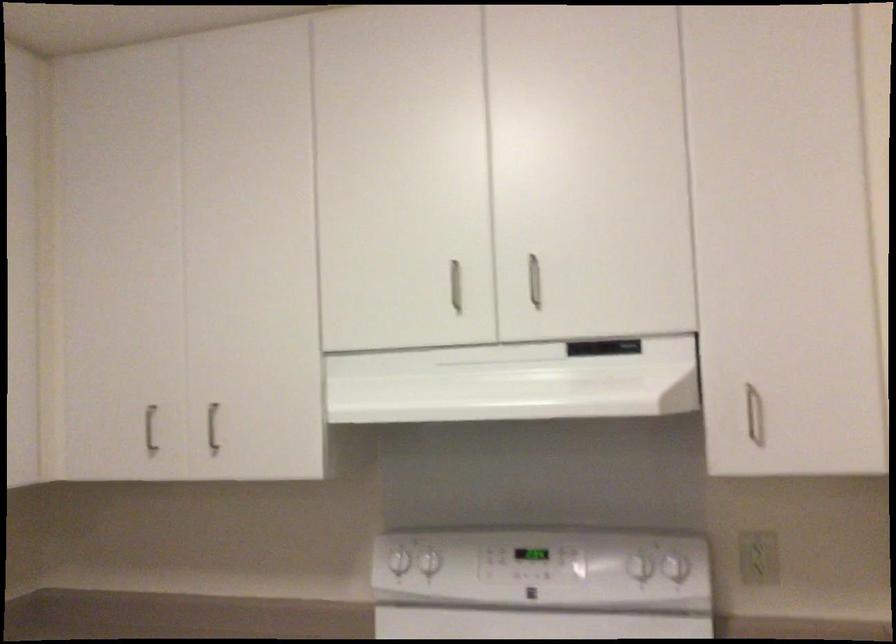
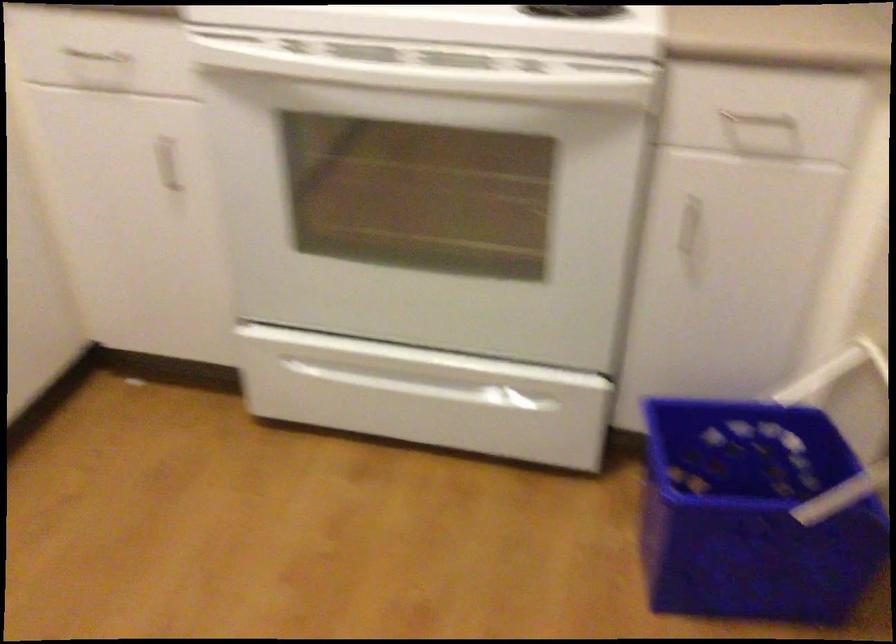
Question: Based on the continuous images, in which direction is the camera rotating? Reply with the corresponding letter.

Choices:
 (A) Left
 (B) Right
 (C) Up
 (D) Down

Answer: (D)